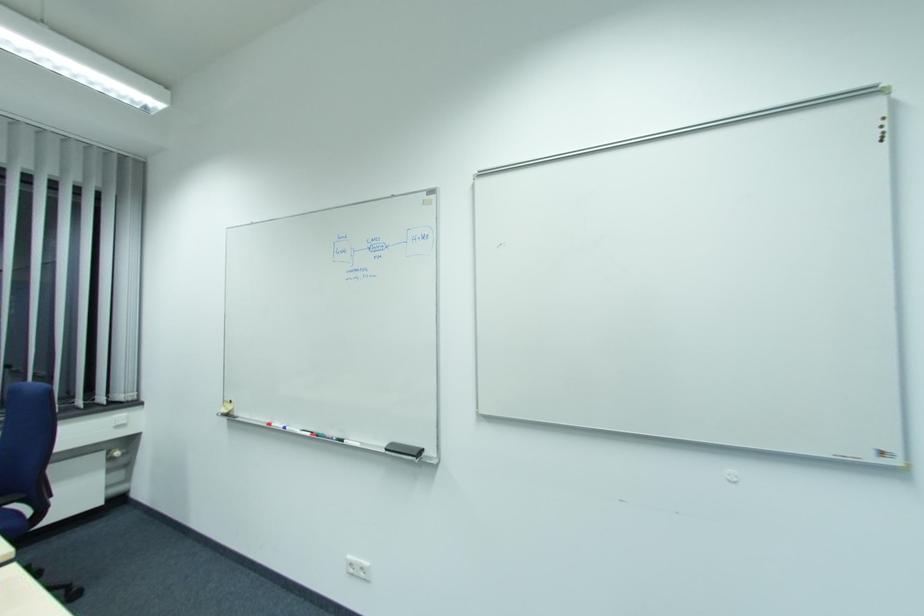
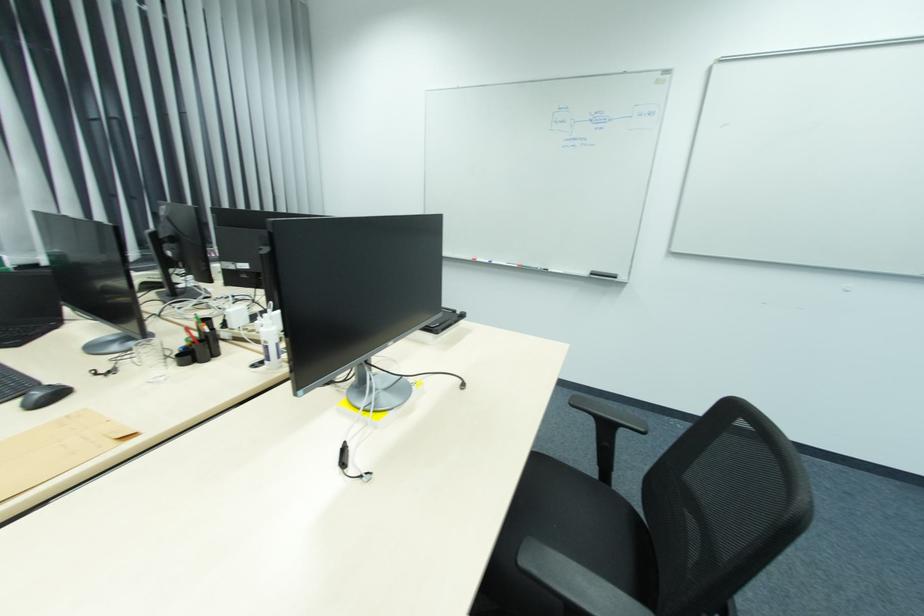
Locate, in the second image, the point that corresponds to (x=392, y=444) in the first image.

(592, 272)